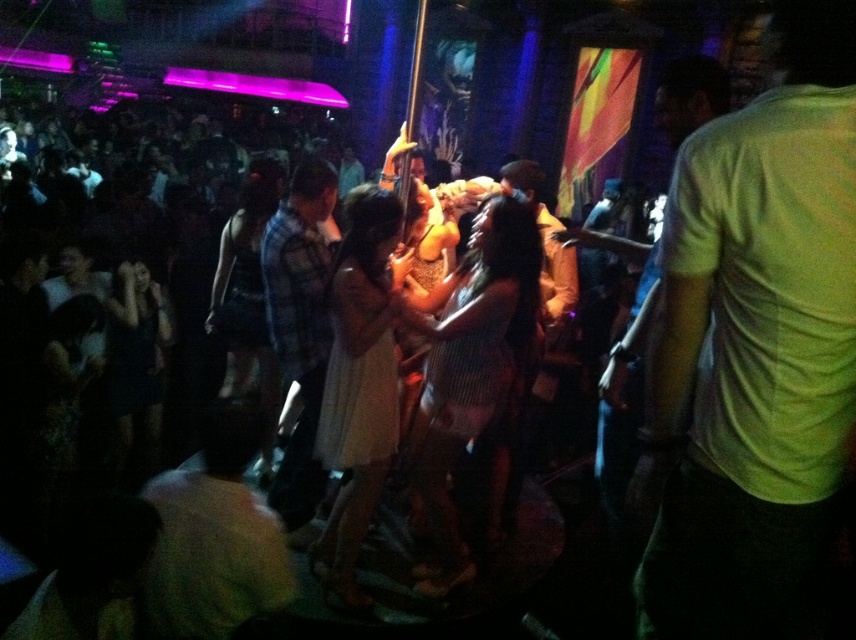
Who is more distant from viewer, (242,410) or (290,476)?

Point (290,476)

Between white matte shirt at lower left and plaid fabric shirt at center, which one appears on the right side from the viewer's perspective?

From the viewer's perspective, plaid fabric shirt at center appears more on the right side.

Locate an element on the screen. The height and width of the screenshot is (640, 856). white matte shirt at lower left is located at coordinates click(x=214, y=538).

In the scene shown: Between light green t-shirt at right and white matte shirt at lower left, which one appears on the left side from the viewer's perspective?

white matte shirt at lower left is more to the left.

Identify the location of light green t-shirt at right. This screenshot has width=856, height=640. (753, 344).

What do you see at coordinates (753, 344) in the screenshot? The image size is (856, 640). I see `light green t-shirt at right` at bounding box center [753, 344].

Between light green t-shirt at right and plaid fabric shirt at center, which one appears on the left side from the viewer's perspective?

plaid fabric shirt at center

What do you see at coordinates (753, 344) in the screenshot? The image size is (856, 640). I see `light green t-shirt at right` at bounding box center [753, 344].

The width and height of the screenshot is (856, 640). I want to click on light green t-shirt at right, so click(753, 344).